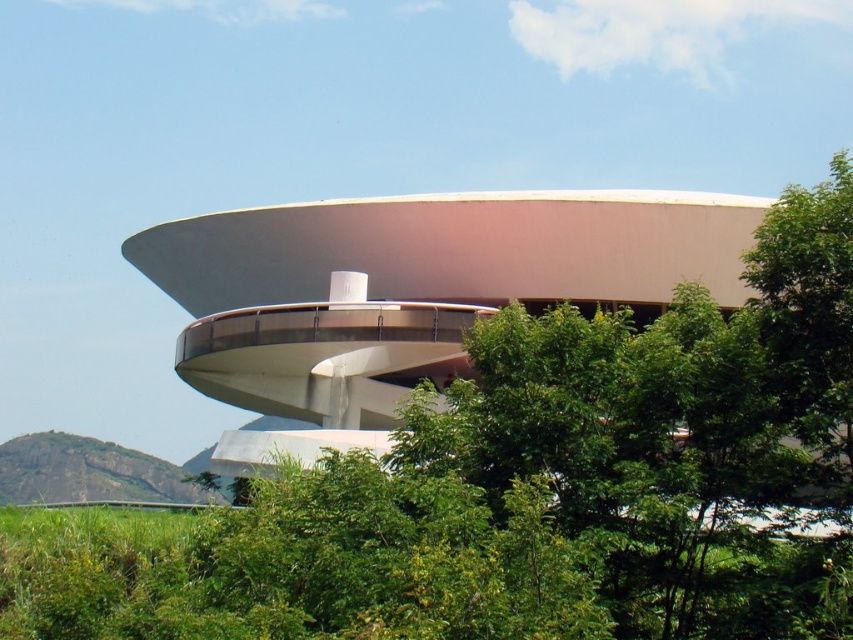
You are standing at a viewpoint 100 meters away from the modern architectural structure. You notice a specific point marked at coordinates point (537,225) on the building. Can you determine if this point is closer to you than your current position?

The distance of point (537,225) from camera is 82.47 meters, so yes, the point is closer to you than your current position which is 100 meters away.

You are an architect designing a new garden layout for this building. You have to place a small statue exactly halfway between the green leafy tree at right and the rugged rock at lower left. Which object will the statue be closer to?

The statue will be closer to the rugged rock at lower left because the green leafy tree at right is bigger than rugged rock at lower left, but the question is about distance, not size. The statue placed halfway between them would depend on their spatial positions, but since size isn not related to distance, the answer cannot be determined from the given information. However, based on typical spatial arrangements, if the tree is at the right and the rock at the lower left, the midpoint would be closer to the

You are standing at the center of a large open field. In front of you, you see the white smooth building at center. If you were to walk directly towards the building, which direction should you face to ensure you are moving straight towards it?

Since the white smooth building at center is positioned at point coordinates (409, 291), you should face the direction corresponding to those coordinates to walk straight towards it.